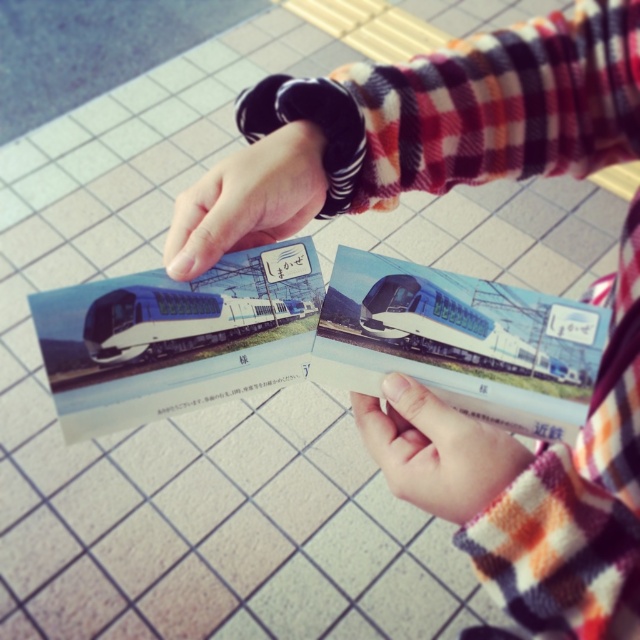
Between plaid fabric arm at center and smooth black wristwatch at upper center, which one has more height?

plaid fabric arm at center

This screenshot has height=640, width=640. What do you see at coordinates (419, 129) in the screenshot?
I see `plaid fabric arm at center` at bounding box center [419, 129].

Where is `plaid fabric arm at center`? This screenshot has width=640, height=640. plaid fabric arm at center is located at coordinates (419, 129).

Does smooth skin hand at center have a greater height compared to silver metallic train at center?

Correct, smooth skin hand at center is much taller as silver metallic train at center.

Is smooth skin hand at center smaller than silver metallic train at center?

Incorrect, smooth skin hand at center is not smaller in size than silver metallic train at center.

Who is more forward, (451,490) or (132,348)?

Point (451,490) is more forward.

You are a GUI agent. You are given a task and a screenshot of the screen. Output one action in this format:
    pyautogui.click(x=<x>, y=<y>)
    Task: Click on the smooth skin hand at center
    The width and height of the screenshot is (640, 640).
    Given the screenshot: What is the action you would take?
    pyautogui.click(x=435, y=451)

Does plaid fabric arm at center have a lesser height compared to smooth skin hand at center?

In fact, plaid fabric arm at center may be taller than smooth skin hand at center.

Consider the image. Is plaid fabric arm at center to the right of smooth skin hand at center from the viewer's perspective?

Yes, plaid fabric arm at center is to the right of smooth skin hand at center.

Who is more distant from viewer, (376, 68) or (509, 465)?

Positioned behind is point (376, 68).

Where is `plaid fabric arm at center`? The image size is (640, 640). plaid fabric arm at center is located at coordinates (419, 129).